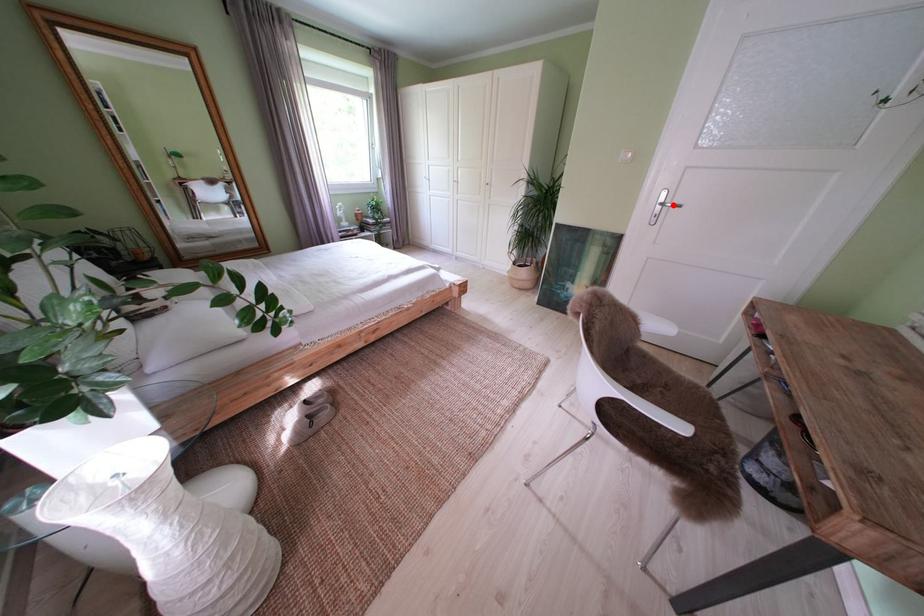
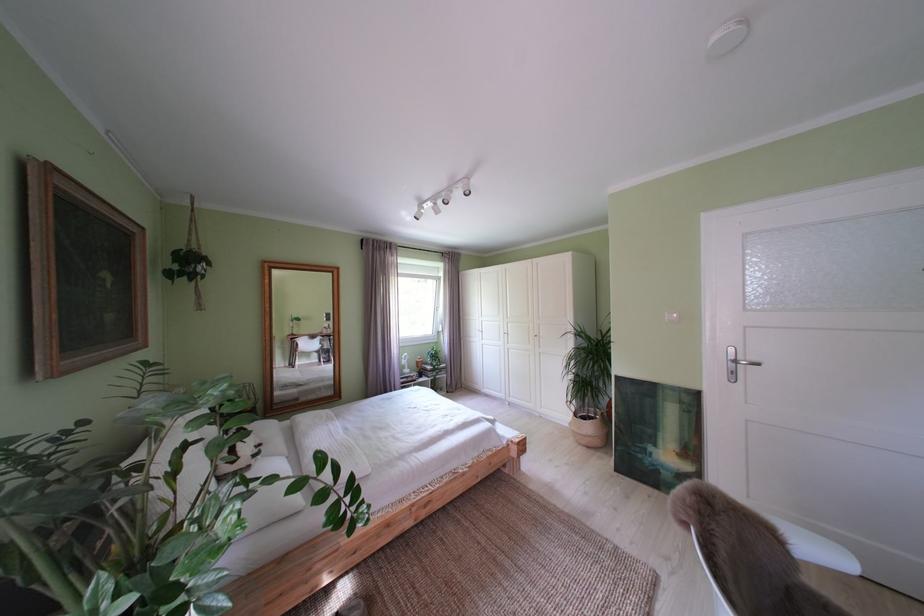
In the second image, find the point that corresponds to the highlighted location in the first image.

(743, 363)